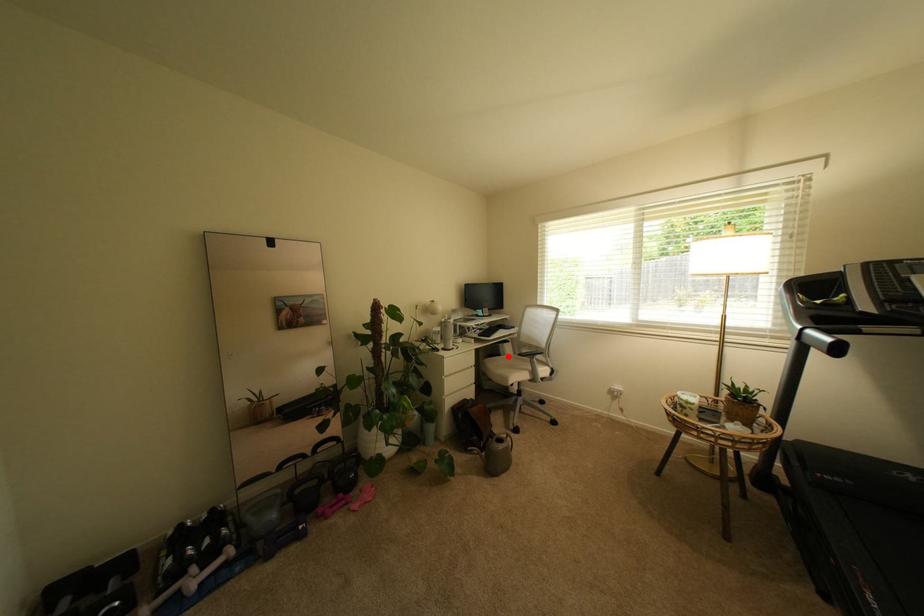
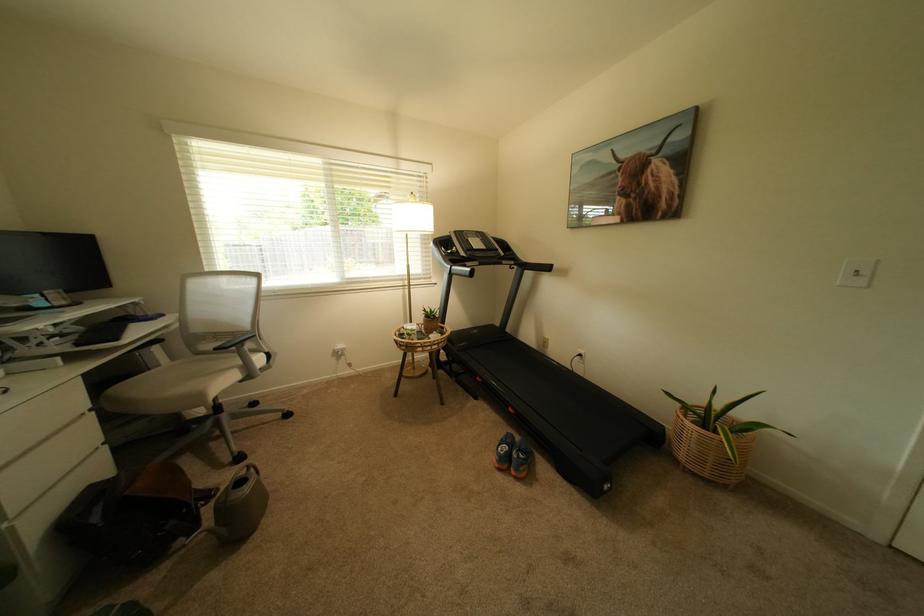
Locate, in the second image, the point that corresponds to the highlighted location in the first image.

(157, 370)